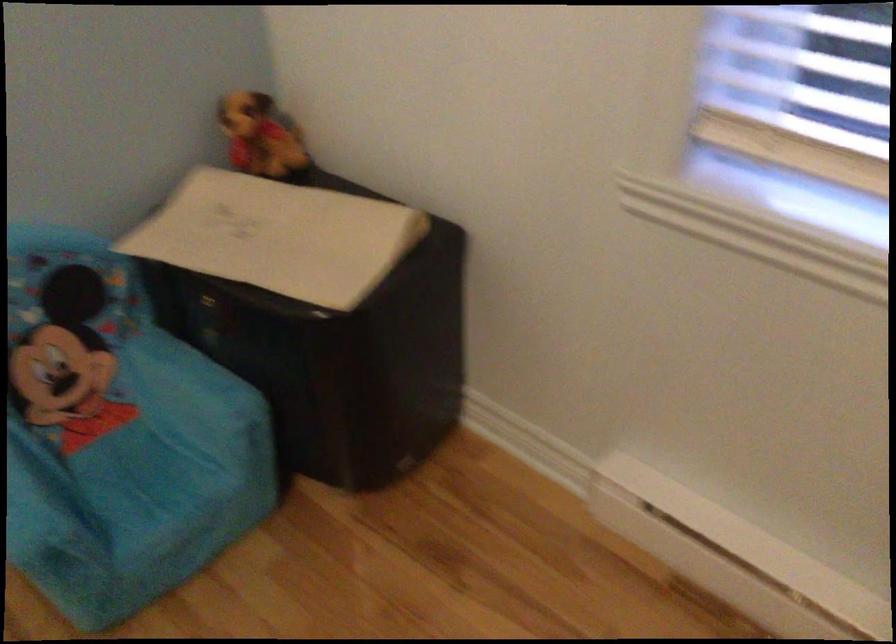
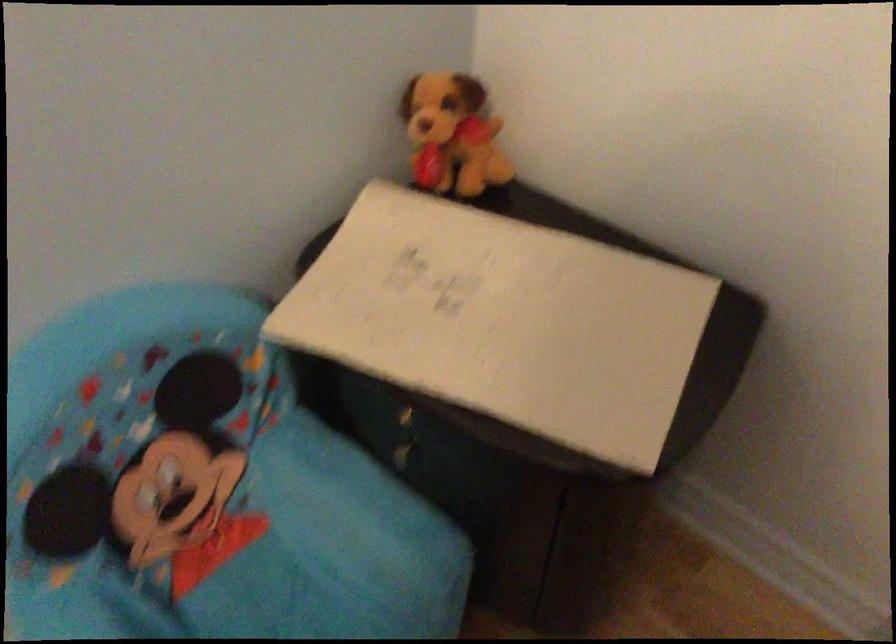
Question: Based on the continuous images, in which direction is the camera rotating? Reply with the corresponding letter.

Choices:
 (A) Left
 (B) Right
 (C) Up
 (D) Down

Answer: (D)